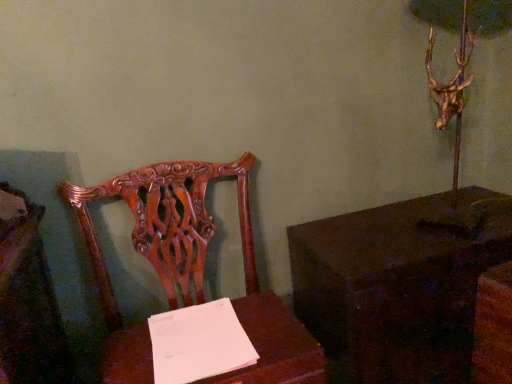
Question: Does point (243, 306) appear closer or farther from the camera than point (328, 283)?

Choices:
 (A) farther
 (B) closer

Answer: (A)

Question: From the image's perspective, is polished wood chair at center located above or below dark wood table at right, which is counted as the second table, starting from the left?

Choices:
 (A) below
 (B) above

Answer: (B)

Question: Based on their relative distances, which object is nearer to the dark wood table at right, which is counted as the first table, starting from the right?

Choices:
 (A) polished wood chair at center
 (B) wooden table at center, which ranks as the second table in right-to-left order

Answer: (B)

Question: Based on their relative distances, which object is farther from the polished wood chair at center?

Choices:
 (A) wooden table at center, which ranks as the second table in right-to-left order
 (B) dark wood table at right, which is counted as the first table, starting from the right

Answer: (B)